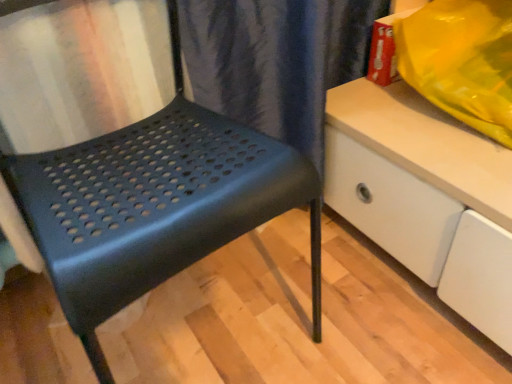
Measure the distance between point (130,245) and camera.

Point (130,245) is 20.20 inches away from camera.

The image size is (512, 384). What do you see at coordinates (154, 204) in the screenshot?
I see `metallic blue chair at center` at bounding box center [154, 204].

Where is `metallic blue chair at center`? The width and height of the screenshot is (512, 384). metallic blue chair at center is located at coordinates (154, 204).

This screenshot has height=384, width=512. Find the location of `metallic blue chair at center`. metallic blue chair at center is located at coordinates (154, 204).